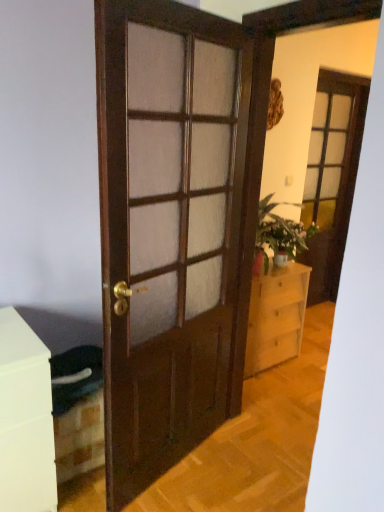
Where is `vacant space underneath matte glass screen door at upper right (from a real-world perspective)`? The height and width of the screenshot is (512, 384). vacant space underneath matte glass screen door at upper right (from a real-world perspective) is located at coordinates (317, 309).